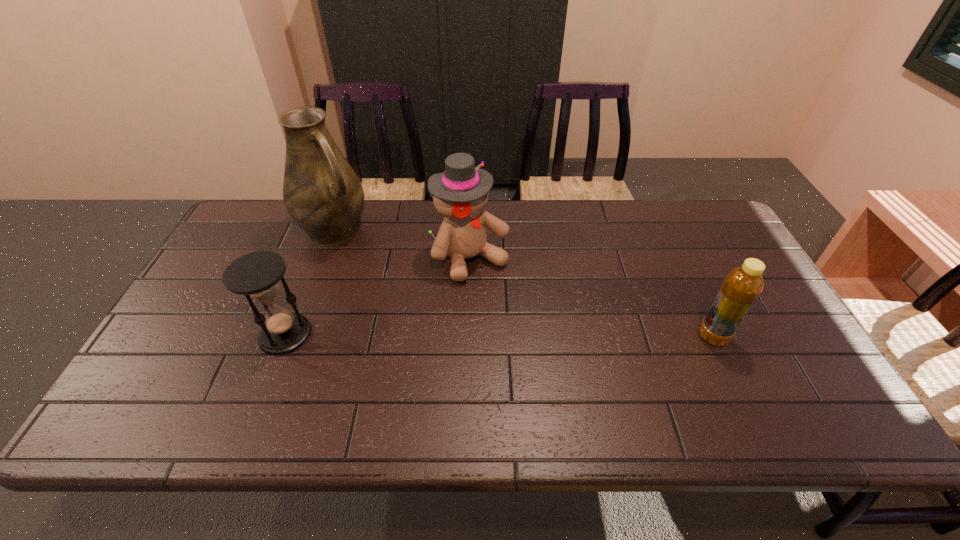
Choose which object is the nearest neighbor to the bottle. Please provide its 2D coordinates. Your answer should be formatted as a tuple, i.e. [(x, y)], where the tuple contains the x and y coordinates of a point satisfying the conditions above.

[(460, 193)]

Identify which object is the second closest to the rightmost object. Please provide its 2D coordinates. Your answer should be formatted as a tuple, i.e. [(x, y)], where the tuple contains the x and y coordinates of a point satisfying the conditions above.

[(322, 193)]

Locate an element on the screen. This screenshot has width=960, height=540. free region that satisfies the following two spatial constraints: 1. on the back side of the hourglass; 2. on the left side of the third object from left to right is located at coordinates (315, 258).

Find the location of a particular element. This screenshot has width=960, height=540. free location that satisfies the following two spatial constraints: 1. on the front side of the pitcher; 2. on the left side of the rag_doll is located at coordinates (323, 258).

The height and width of the screenshot is (540, 960). Find the location of `free space that satisfies the following two spatial constraints: 1. on the front side of the pitcher; 2. on the right side of the rightmost object`. free space that satisfies the following two spatial constraints: 1. on the front side of the pitcher; 2. on the right side of the rightmost object is located at coordinates (294, 336).